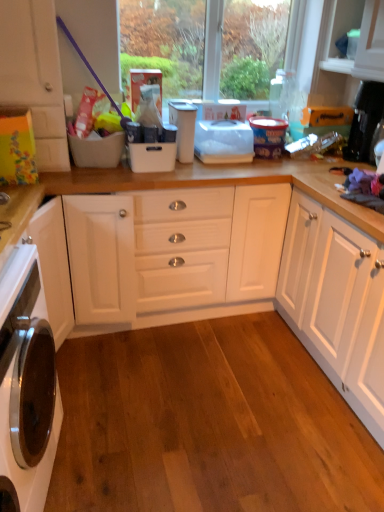
Question: Considering the relative sizes of white glossy oven at lower left and white matte cabinet at left in the image provided, is white glossy oven at lower left taller than white matte cabinet at left?

Choices:
 (A) yes
 (B) no

Answer: (A)

Question: Is white glossy oven at lower left not close to white matte cabinet at left?

Choices:
 (A) no
 (B) yes

Answer: (A)

Question: Is white matte cabinet at left at the back of white glossy oven at lower left?

Choices:
 (A) yes
 (B) no

Answer: (B)

Question: Is white matte cabinet at left a part of white glossy oven at lower left?

Choices:
 (A) yes
 (B) no

Answer: (B)

Question: Does white glossy oven at lower left have a smaller size compared to white matte cabinet at left?

Choices:
 (A) no
 (B) yes

Answer: (A)

Question: Are white glossy oven at lower left and white matte cabinet at left making contact?

Choices:
 (A) yes
 (B) no

Answer: (B)

Question: Are white plastic container at center and white matte cabinet at left making contact?

Choices:
 (A) no
 (B) yes

Answer: (A)

Question: From the image's perspective, would you say white plastic container at center is positioned over white matte cabinet at left?

Choices:
 (A) yes
 (B) no

Answer: (B)

Question: From the image's perspective, is white plastic container at center under white matte cabinet at left?

Choices:
 (A) no
 (B) yes

Answer: (B)

Question: From a real-world perspective, is white plastic container at center physically below white matte cabinet at left?

Choices:
 (A) yes
 (B) no

Answer: (A)

Question: Is white plastic container at center bigger than white matte cabinet at left?

Choices:
 (A) no
 (B) yes

Answer: (A)

Question: Does white plastic container at center appear on the left side of white matte cabinet at left?

Choices:
 (A) no
 (B) yes

Answer: (A)

Question: Can you confirm if white plastic container at center is bigger than white glossy oven at lower left?

Choices:
 (A) no
 (B) yes

Answer: (A)